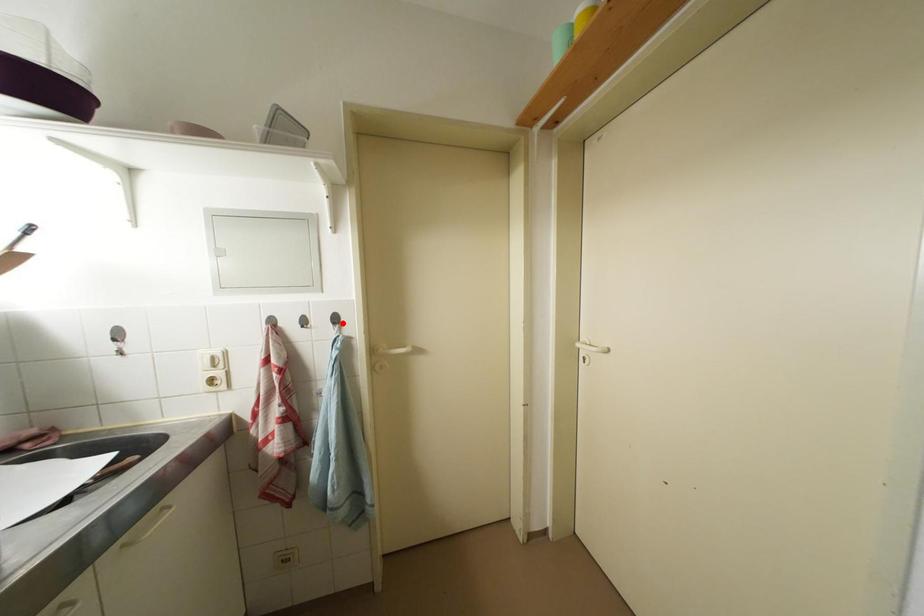
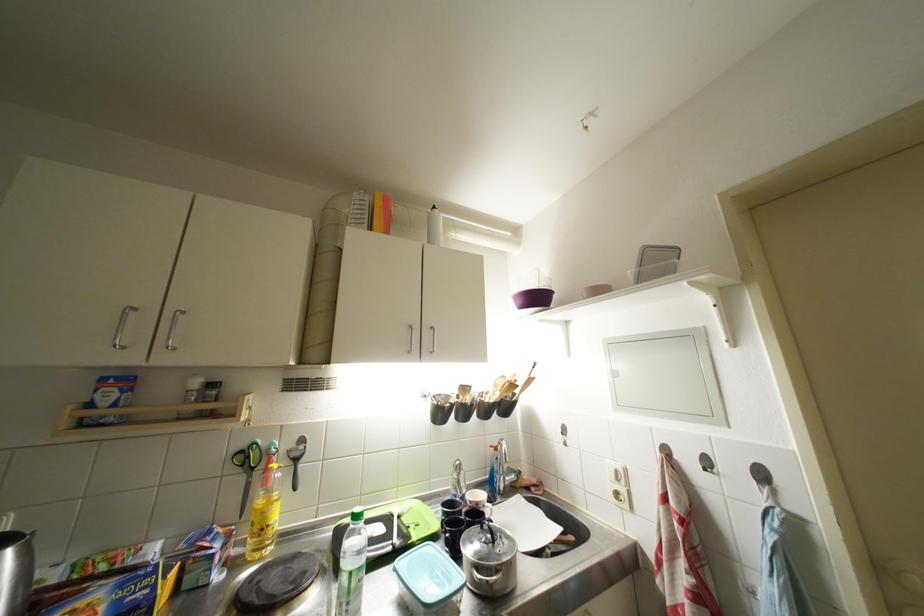
Locate, in the second image, the point that corresponds to the highlighted location in the first image.

(769, 479)